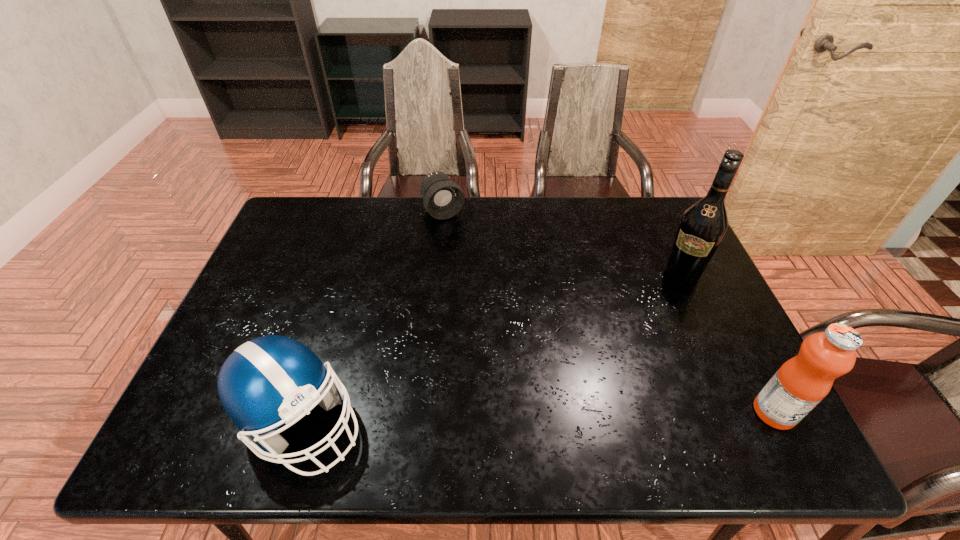
Find the location of `free region located on the label of the tallest object`. free region located on the label of the tallest object is located at coordinates (651, 333).

Find the location of a particular element. free space located 0.080m on the label of the tallest object is located at coordinates pos(667,302).

This screenshot has width=960, height=540. I want to click on vacant space situated 0.400m on the label of the tallest object, so click(622, 386).

I want to click on object that is at the far edge, so click(x=443, y=198).

You are a GUI agent. You are given a task and a screenshot of the screen. Output one action in this format:
    pyautogui.click(x=<x>, y=<y>)
    Task: Click on the football helmet located in the near edge section of the desktop
    The image size is (960, 540).
    Given the screenshot: What is the action you would take?
    pyautogui.click(x=272, y=380)

Where is `fruit juice located in the near edge section of the desktop`? This screenshot has width=960, height=540. fruit juice located in the near edge section of the desktop is located at coordinates (802, 382).

Identify the location of object present at the left edge. This screenshot has width=960, height=540. (272, 380).

Find the location of a particular element. fruit juice located in the right edge section of the desktop is located at coordinates (802, 382).

Find the location of `wine bottle that is positioned at the right edge`. wine bottle that is positioned at the right edge is located at coordinates (702, 228).

Where is `object that is at the near left corner`? The width and height of the screenshot is (960, 540). object that is at the near left corner is located at coordinates (272, 380).